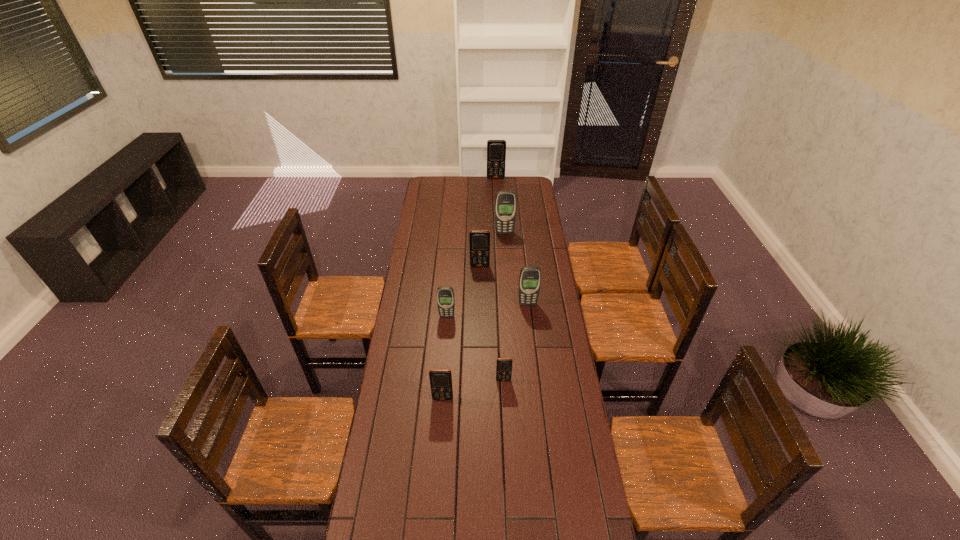
Image resolution: width=960 pixels, height=540 pixels. Find the location of `the nearest object`. the nearest object is located at coordinates (440, 379).

You are a GUI agent. You are given a task and a screenshot of the screen. Output one action in this format:
    pyautogui.click(x=<x>, y=<y>)
    Task: Click on the nearest cellular telephone
    
    Given the screenshot: What is the action you would take?
    pos(440,379)

The width and height of the screenshot is (960, 540). Identify the location of the second nearest object. (504, 365).

You are a GUI agent. You are given a task and a screenshot of the screen. Output one action in this format:
    pyautogui.click(x=<x>, y=<y>)
    Task: Click on the smallest orange cellular telephone
    
    Given the screenshot: What is the action you would take?
    pyautogui.click(x=504, y=365)

I want to click on vacant area situated on the screen of the biggest orange cellular telephone, so click(x=496, y=190).

At what (x,y) coordinates should I click in order to perform the action: click on vacant position located on the screen of the farthest gray cellular telephone. Please return your answer as a coordinate pair (x, y). This screenshot has width=960, height=540. Looking at the image, I should click on (507, 265).

I want to click on vacant space situated 0.300m on the screen of the fifth nearest cellular telephone, so click(x=480, y=310).

Locate an element on the screen. This screenshot has width=960, height=540. free space located on the screen of the second nearest gray cellular telephone is located at coordinates (535, 365).

In order to click on free space located on the screen of the third nearest object in this screenshot , I will do `click(444, 353)`.

This screenshot has height=540, width=960. In order to click on free space located 0.050m on the screen of the nearest cellular telephone in this screenshot , I will do `click(442, 413)`.